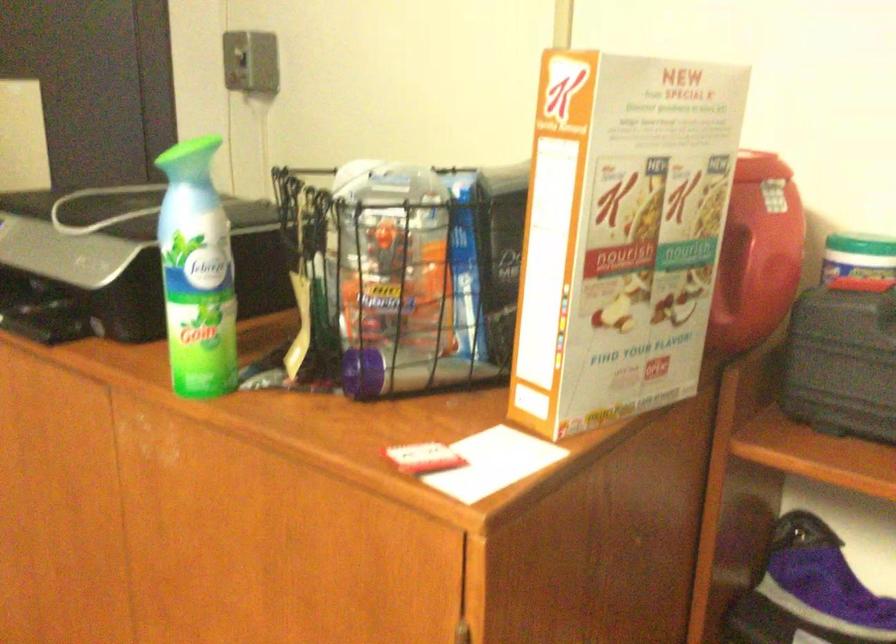
Identify the location of black wire basket. (401, 275).